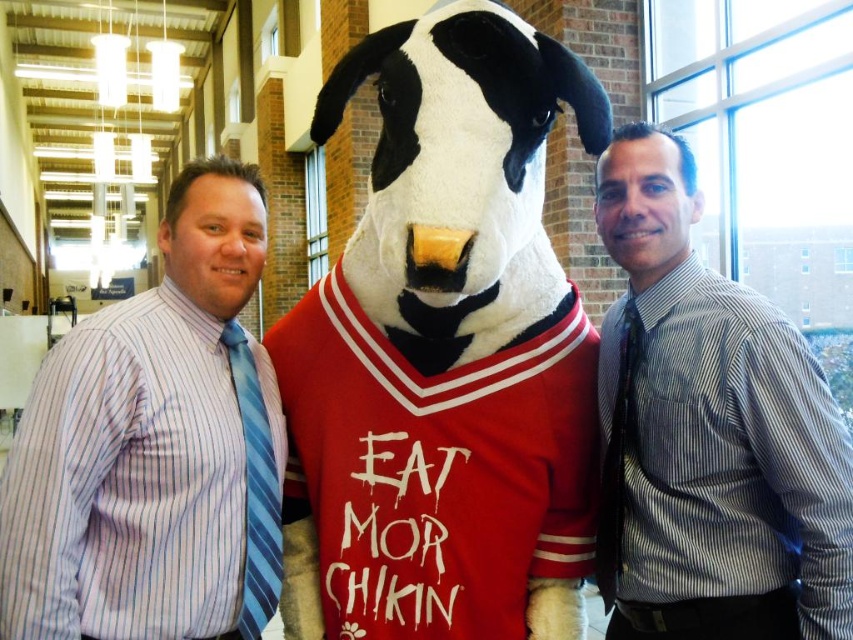
Question: Which of the following is the farthest from the observer?

Choices:
 (A) black textured tie at right
 (B) blue striped tie at left
 (C) striped shirt at right

Answer: (A)

Question: In this image, where is striped shirt at right located relative to blue striped tie at left?

Choices:
 (A) below
 (B) above

Answer: (B)

Question: Is the position of blue striped shirt at left more distant than that of black textured tie at right?

Choices:
 (A) yes
 (B) no

Answer: (B)

Question: Among these points, which one is farthest from the camera?

Choices:
 (A) (460, 497)
 (B) (254, 456)
 (C) (625, 484)

Answer: (C)

Question: Which of these objects is positioned farthest from the blue striped shirt at left?

Choices:
 (A) white plush dog at center
 (B) blue striped tie at left

Answer: (A)

Question: Is blue striped tie at left thinner than black textured tie at right?

Choices:
 (A) no
 (B) yes

Answer: (A)